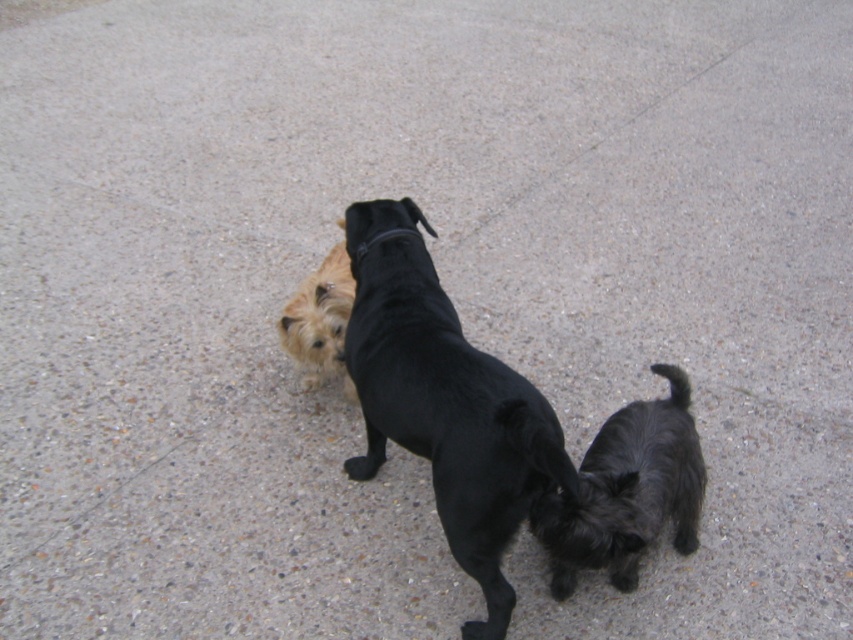
In the scene shown: You are a photographer trying to capture the black smooth dog at center. You notice the black leather neckband at center is blocking part of the dog. Can you move closer to the dog to get a clearer shot without the neckband in the way?

The black smooth dog at center is closer to the viewer than the black leather neckband at center, so moving closer to the dog would bring the neckband into focus more, not less. To avoid the neckband blocking the view, you should adjust your angle instead of moving closer.

You are standing 2.5 meters away from the golden fur dog at center. Can you reach it without moving closer?

The golden fur dog at center is 2.37 meters away from the viewer. Since you are 2.5 meters away, you are slightly farther than the distance to the golden fur dog at center, so you cannot reach it without moving closer.